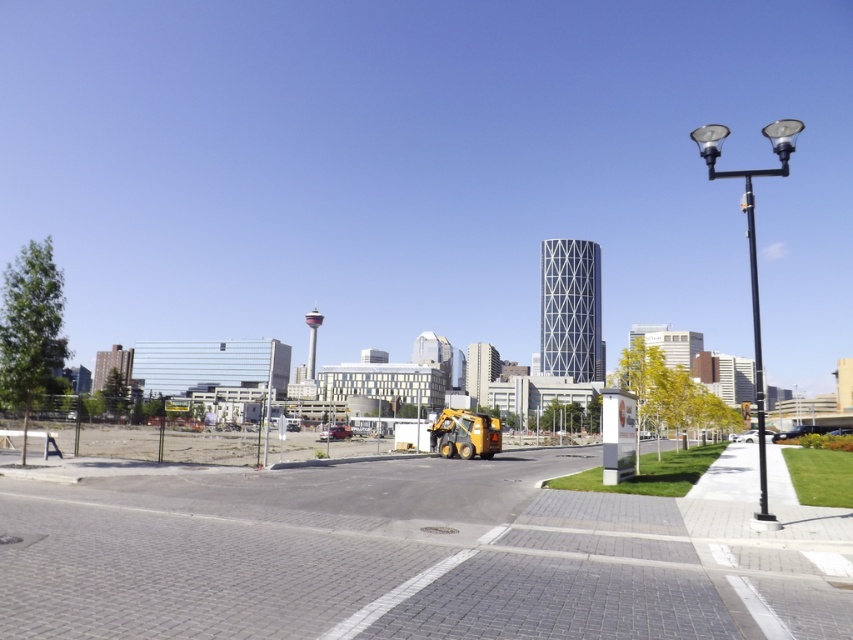
Question: Does yellow compact tractor at center have a larger size compared to black metal lamp post at right?

Choices:
 (A) no
 (B) yes

Answer: (A)

Question: Is yellow compact tractor at center to the left of black metal lamp post at right from the viewer's perspective?

Choices:
 (A) yes
 (B) no

Answer: (A)

Question: Among these objects, which one is farthest from the camera?

Choices:
 (A) black metal lamp post at right
 (B) yellow compact tractor at center

Answer: (A)

Question: Is yellow compact tractor at center positioned in front of black metal lamp post at right?

Choices:
 (A) yes
 (B) no

Answer: (A)